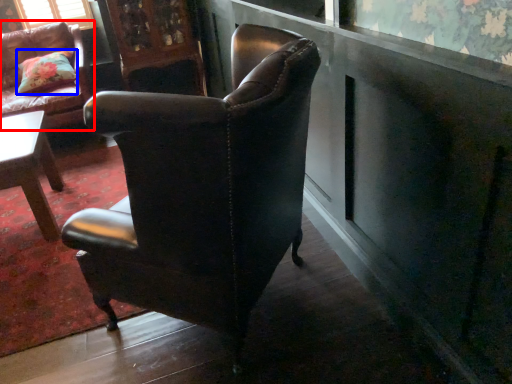
Question: Which object appears closest to the camera in this image, chair (highlighted by a red box) or pillow (highlighted by a blue box)?

Choices:
 (A) chair
 (B) pillow

Answer: (A)